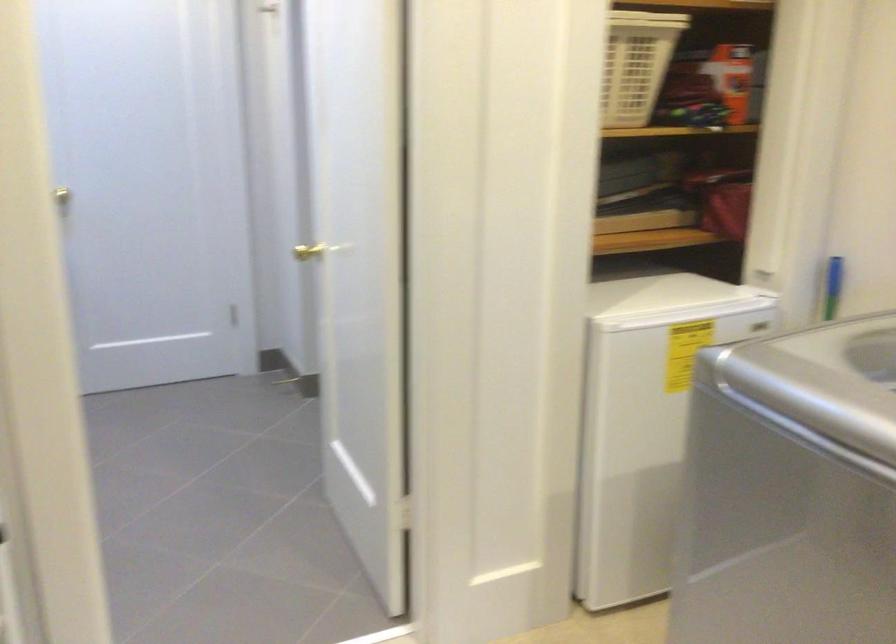
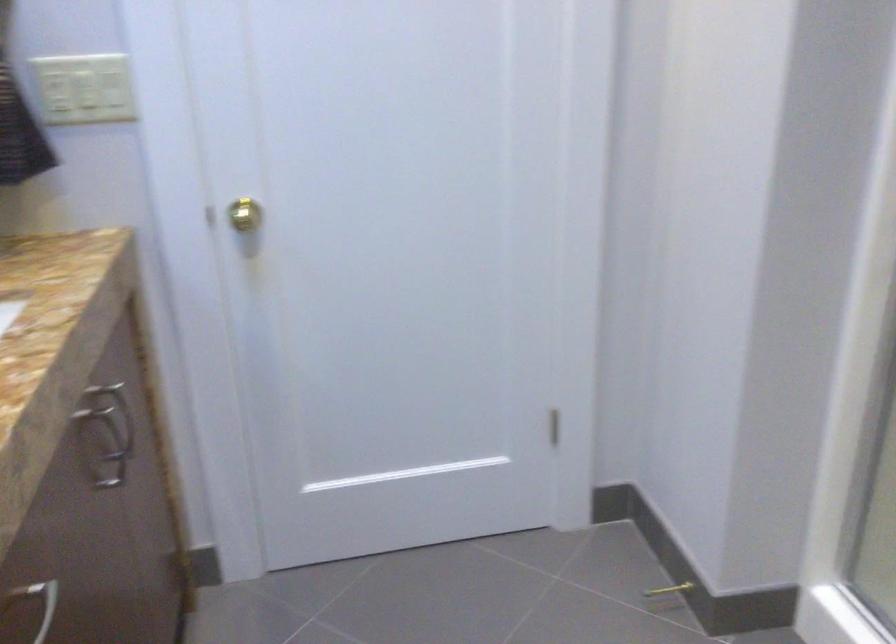
Where in the second image is the point corresponding to (x=71, y=190) from the first image?

(240, 214)